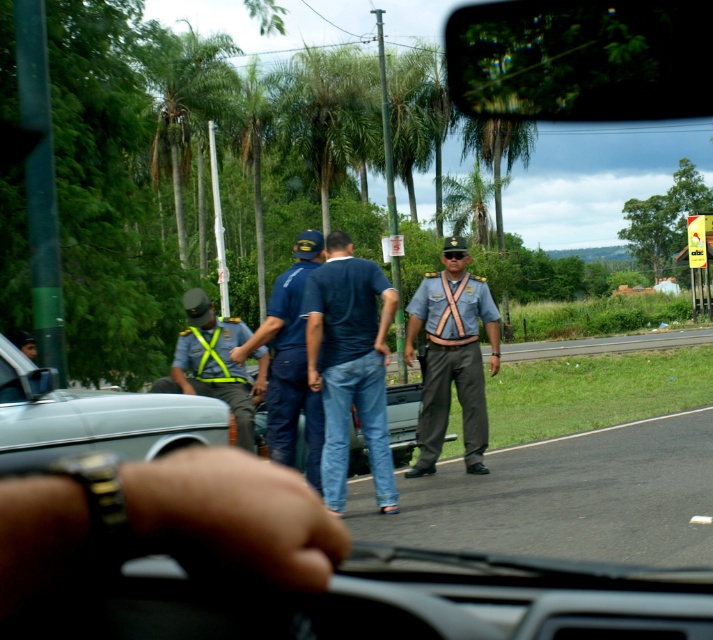
Is gray uniformed officer at center shorter than matte brown suspenders at center?

No.

Who is positioned more to the left, gray uniformed officer at center or matte brown suspenders at center?

Positioned to the left is gray uniformed officer at center.

This screenshot has height=640, width=713. What do you see at coordinates (451, 355) in the screenshot? I see `gray uniformed officer at center` at bounding box center [451, 355].

This screenshot has height=640, width=713. I want to click on gray uniformed officer at center, so [x=451, y=355].

In the scene shown: Who is positioned more to the right, blue uniform at center or yellow reflective vest at center?

blue uniform at center is more to the right.

In the scene shown: Can you confirm if blue uniform at center is positioned to the right of yellow reflective vest at center?

Correct, you'll find blue uniform at center to the right of yellow reflective vest at center.

The height and width of the screenshot is (640, 713). I want to click on blue uniform at center, so click(289, 362).

Is gray uniformed officer at center below blue uniform at center?

No, gray uniformed officer at center is not below blue uniform at center.

What do you see at coordinates (451, 355) in the screenshot? This screenshot has height=640, width=713. I see `gray uniformed officer at center` at bounding box center [451, 355].

Find the location of a particular element. gray uniformed officer at center is located at coordinates (451, 355).